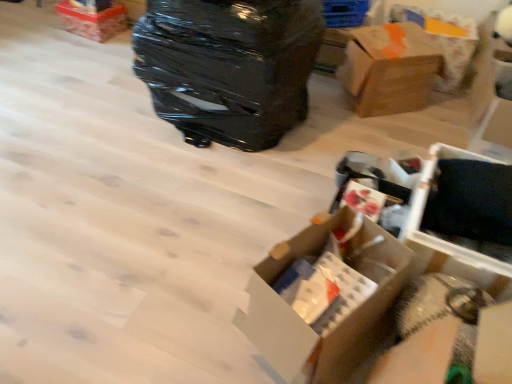
Find the location of `free space that is to the left of black plastic suitcase at upper center`. free space that is to the left of black plastic suitcase at upper center is located at coordinates (87, 119).